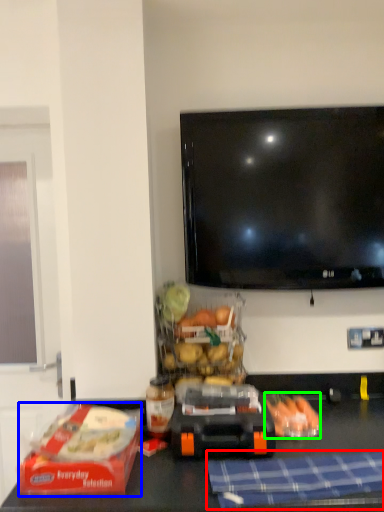
Question: Which is nearer to the blanket (highlighted by a red box)? lunch box (highlighted by a blue box) or food (highlighted by a green box).

Choices:
 (A) lunch box
 (B) food

Answer: (B)